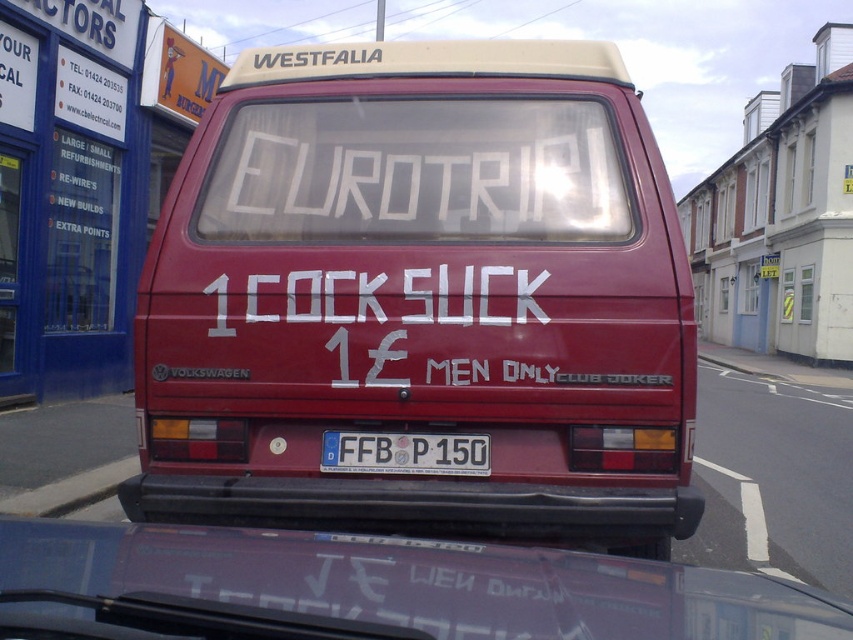
Between point (720, 595) and point (380, 124), which one is positioned behind?

The point (380, 124) is more distant.

Where is `metallic purple car at lower center`? The width and height of the screenshot is (853, 640). metallic purple car at lower center is located at coordinates (370, 589).

Is point (386, 552) farther from viewer compared to point (451, 470)?

No, it is not.

Where is `metallic purple car at lower center`? This screenshot has width=853, height=640. metallic purple car at lower center is located at coordinates (370, 589).

Is point (776, 602) positioned in front of point (335, 432)?

Yes, point (776, 602) is in front of point (335, 432).

Identify the location of metallic purple car at lower center. (370, 589).

Which of these two, maroon matte van at center or white plastic license plate at center, stands shorter?

With less height is white plastic license plate at center.

Is maroon matte van at center shorter than white plastic license plate at center?

No.

Between point (491, 528) and point (442, 451), which one is positioned behind?

Positioned behind is point (442, 451).

Image resolution: width=853 pixels, height=640 pixels. Find the location of `maroon matte van at center`. maroon matte van at center is located at coordinates (421, 298).